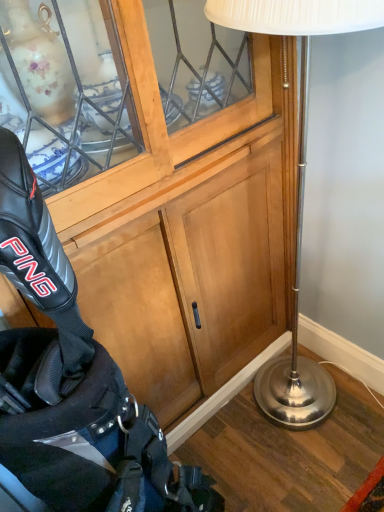
The height and width of the screenshot is (512, 384). What do you see at coordinates (297, 184) in the screenshot? I see `silver metallic floor lamp at center-right` at bounding box center [297, 184].

What is the approximate height of silver metallic floor lamp at center-right?

silver metallic floor lamp at center-right is 1.27 meters in height.

Locate an element on the screen. This screenshot has height=512, width=384. silver metallic floor lamp at center-right is located at coordinates (297, 184).

Where is `silver metallic floor lamp at center-right`? This screenshot has width=384, height=512. silver metallic floor lamp at center-right is located at coordinates (297, 184).